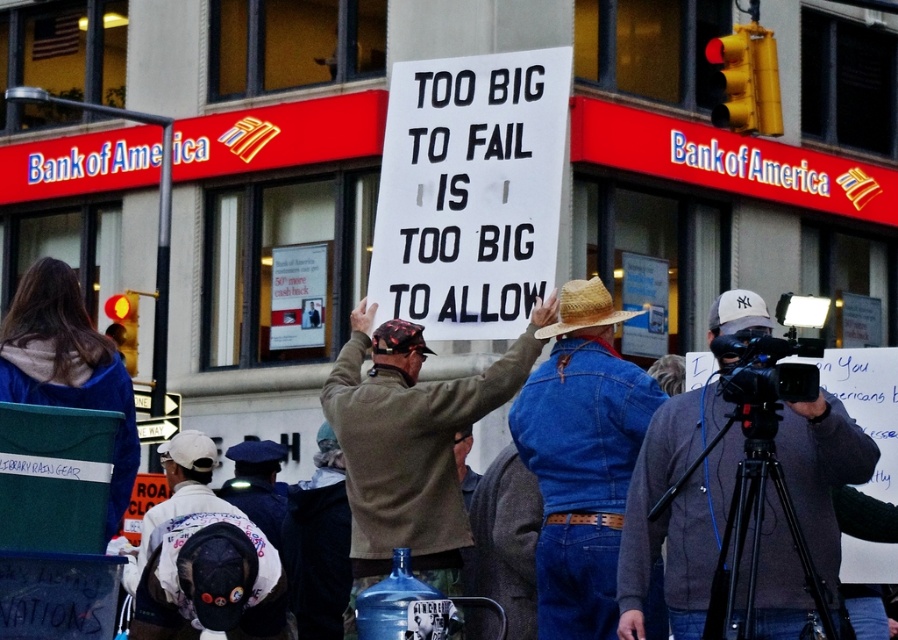
Question: In this image, where is denim jacket at center located relative to khaki cotton jacket at center?

Choices:
 (A) right
 (B) left

Answer: (A)

Question: Which of the following is the farthest from the observer?

Choices:
 (A) denim jacket at center
 (B) strawhat at center
 (C) khaki cotton jacket at center

Answer: (C)

Question: Which is farther from the denim jacket at center?

Choices:
 (A) strawhat at center
 (B) gray fabric jacket at center

Answer: (B)

Question: Considering the real-world distances, which object is closest to the strawhat at center?

Choices:
 (A) denim jacket at center
 (B) gray fabric jacket at center
 (C) khaki cotton jacket at center

Answer: (A)

Question: Does gray fabric jacket at center appear over strawhat at center?

Choices:
 (A) no
 (B) yes

Answer: (A)

Question: Is gray fabric jacket at center to the right of khaki cotton jacket at center from the viewer's perspective?

Choices:
 (A) yes
 (B) no

Answer: (A)